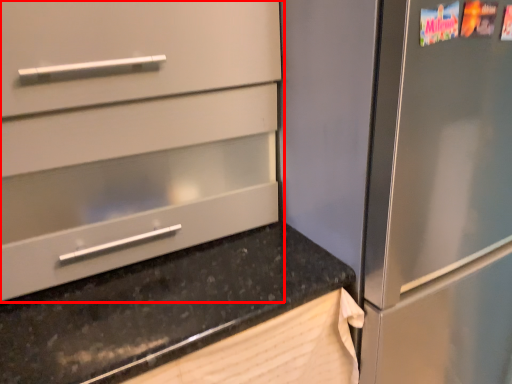
Question: From the image's perspective, considering the relative positions of cabinetry (annotated by the red box) and countertop in the image provided, where is cabinetry (annotated by the red box) located with respect to the staircase?

Choices:
 (A) above
 (B) below

Answer: (A)